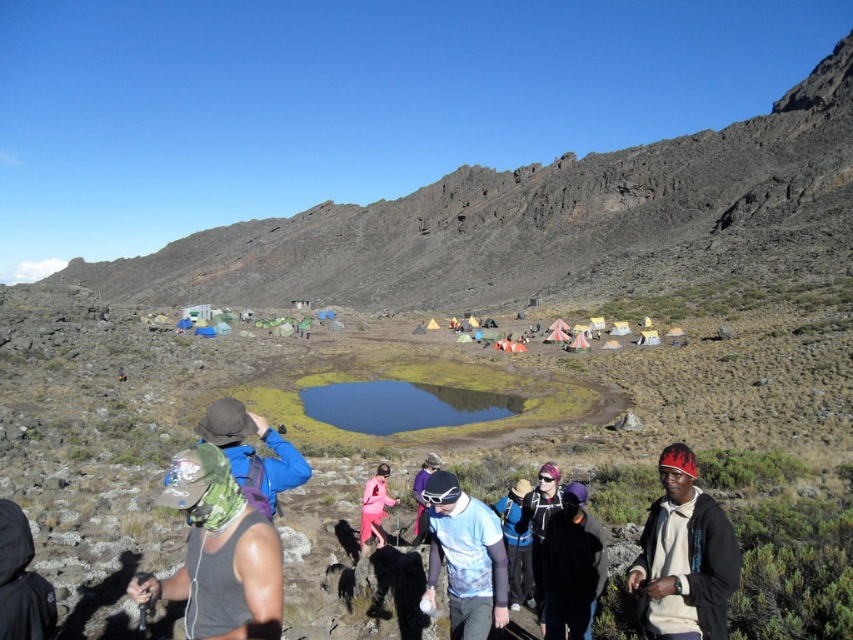
Which is more to the left, black knit cap at center or matte gray helmet at center?

Positioned to the left is matte gray helmet at center.

Which is below, black knit cap at center or matte gray helmet at center?

matte gray helmet at center is lower down.

I want to click on black knit cap at center, so click(x=683, y=556).

Which of these two, camouflage fabric cap at center or camouflage fabric hat at center, stands shorter?

camouflage fabric hat at center is shorter.

From the picture: Does camouflage fabric cap at center lie in front of camouflage fabric hat at center?

Yes, it is.

Measure the distance between point (245,602) and camera.

Point (245,602) and camera are 26.92 meters apart from each other.

What are the coordinates of `camouflage fabric cap at center` in the screenshot? It's located at (219, 554).

Does point (515, 528) lie behind point (368, 486)?

No, it is in front of (368, 486).

Can you confirm if black fleece jacket at center is thinner than pink fabric pants at center?

No.

Describe the element at coordinates (538, 524) in the screenshot. I see `black fleece jacket at center` at that location.

Where is `black fleece jacket at center`? black fleece jacket at center is located at coordinates (538, 524).